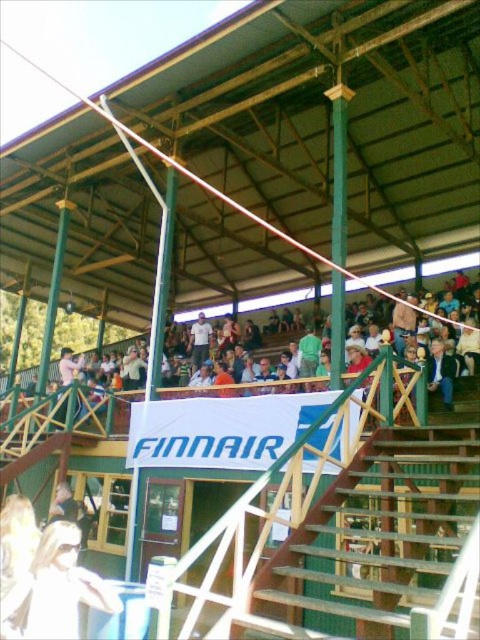
Question: Which object appears closest to the camera in this image?

Choices:
 (A) wooden bleachers at center
 (B) green wooden pole at center
 (C) white cotton shirt at upper center
 (D) blonde hair at lower left

Answer: (D)

Question: Which of the following is the farthest from the observer?

Choices:
 (A) green wooden pole at center
 (B) wooden bleachers at center
 (C) white cotton shirt at upper center
 (D) blonde hair at lower left

Answer: (C)

Question: Can you confirm if green wooden pole at center is positioned below white cotton shirt at upper center?

Choices:
 (A) no
 (B) yes

Answer: (A)

Question: Considering the relative positions of green wooden pole at center and white cotton shirt at upper center in the image provided, where is green wooden pole at center located with respect to white cotton shirt at upper center?

Choices:
 (A) below
 (B) above

Answer: (B)

Question: Is wooden bleachers at center bigger than blonde hair at lower left?

Choices:
 (A) no
 (B) yes

Answer: (B)

Question: Estimate the real-world distances between objects in this image. Which object is farther from the green wooden pole at center?

Choices:
 (A) white cotton shirt at upper center
 (B) wooden bleachers at center

Answer: (A)